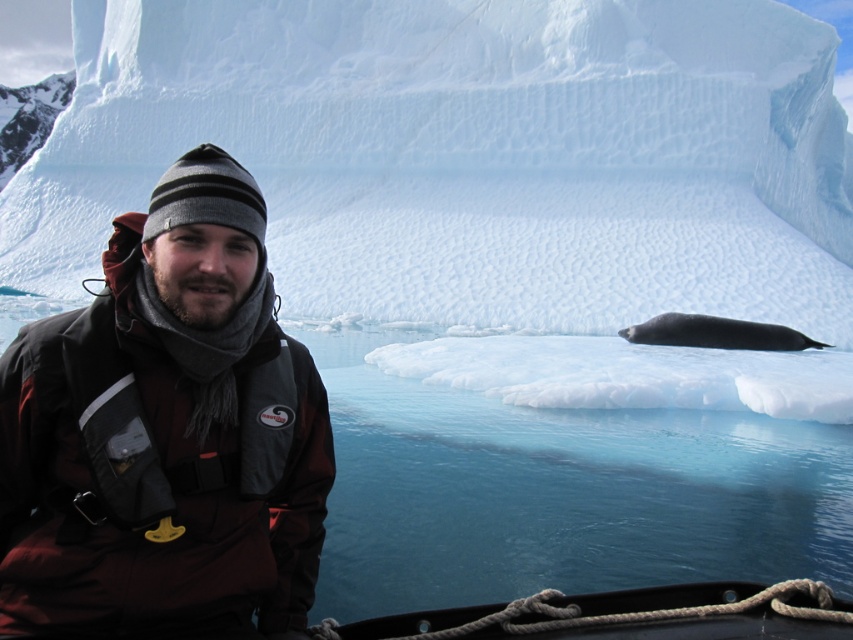
You are standing in front of the iceberg and notice two points marked on the image. The first point is at coordinates point (206,92), and the second is at point (813,480). Which of these points is closer to you?

Point (206,92) is closer to you because it is further to the viewer than point (813,480).

You are a photographer trying to capture the iceberg in the background while ensuring the person in the foreground is also visible. Based on their positions, will the white ice at center and the dark gray knit hat at upper left overlap in your photo?

The white ice at center is located above the dark gray knit hat at upper left, so they will not overlap in the photo.

In the scene shown: You are standing in front of the iceberg and see two points marked on the ice. The first point is at coordinates point (514,316) and the second is at point (770,324). Which point is closer to you?

Point (514,316) is closer to you because it is further to the viewer than point (770,324).